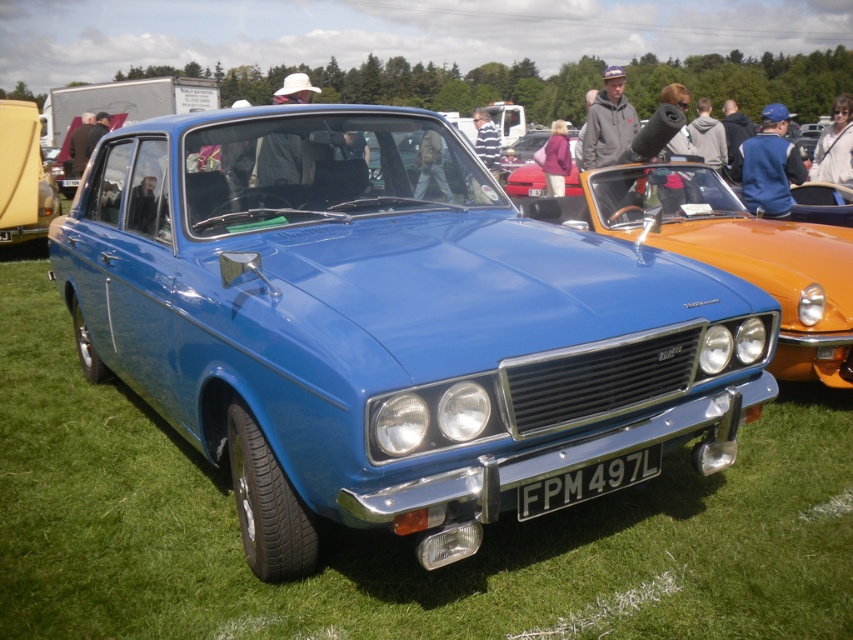
Between green grass at center and white plastic license plate at center, which one is positioned higher?

white plastic license plate at center is above.

Between green grass at center and white plastic license plate at center, which one appears on the left side from the viewer's perspective?

green grass at center

What are the coordinates of `green grass at center` in the screenshot? It's located at tap(393, 534).